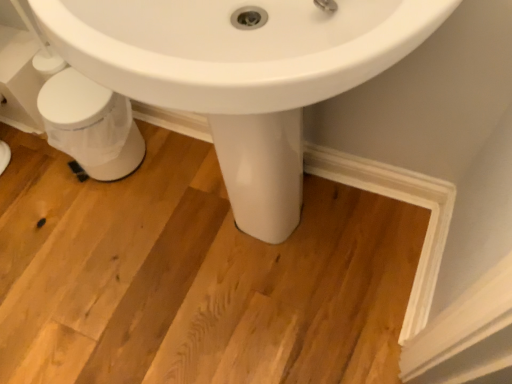
This screenshot has height=384, width=512. Identify the location of free point above white plastic trash can at lower left (from a real-world perspective). (63, 102).